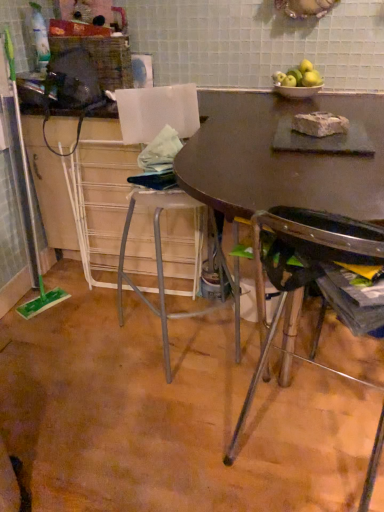
Question: Is point (357, 183) closer or farther from the camera than point (23, 130)?

Choices:
 (A) closer
 (B) farther

Answer: (A)

Question: Visually, is matte brown table at center positioned to the left or to the right of matte brown table at upper center?

Choices:
 (A) right
 (B) left

Answer: (A)

Question: Which object is the farthest from the green matte apples at upper right?

Choices:
 (A) metallic silver chair at lower right
 (B) matte brown table at upper center
 (C) matte brown table at center

Answer: (A)

Question: Estimate the real-world distances between objects in this image. Which object is closer to the matte brown table at upper center?

Choices:
 (A) green matte apples at upper right
 (B) matte brown table at center
 (C) metallic silver chair at lower right

Answer: (B)